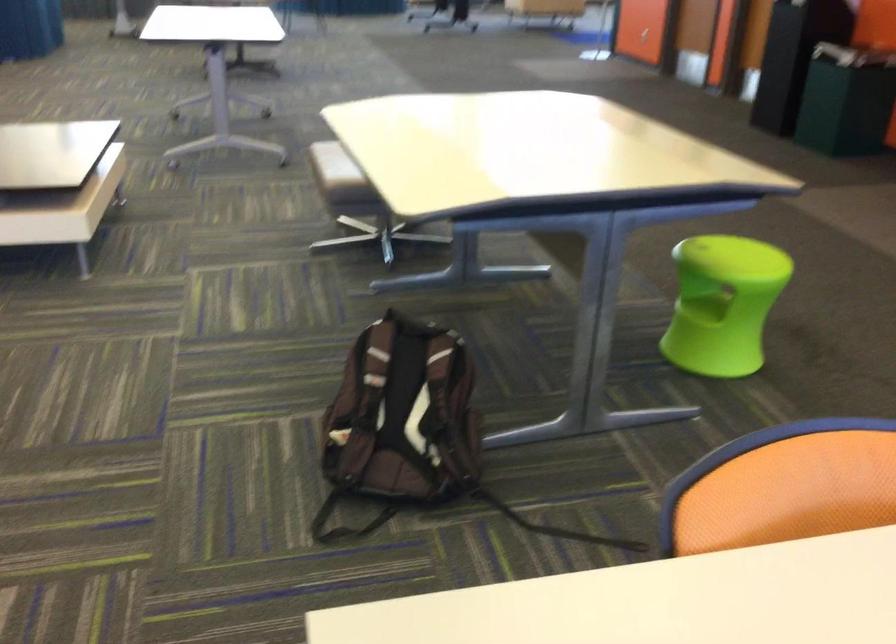
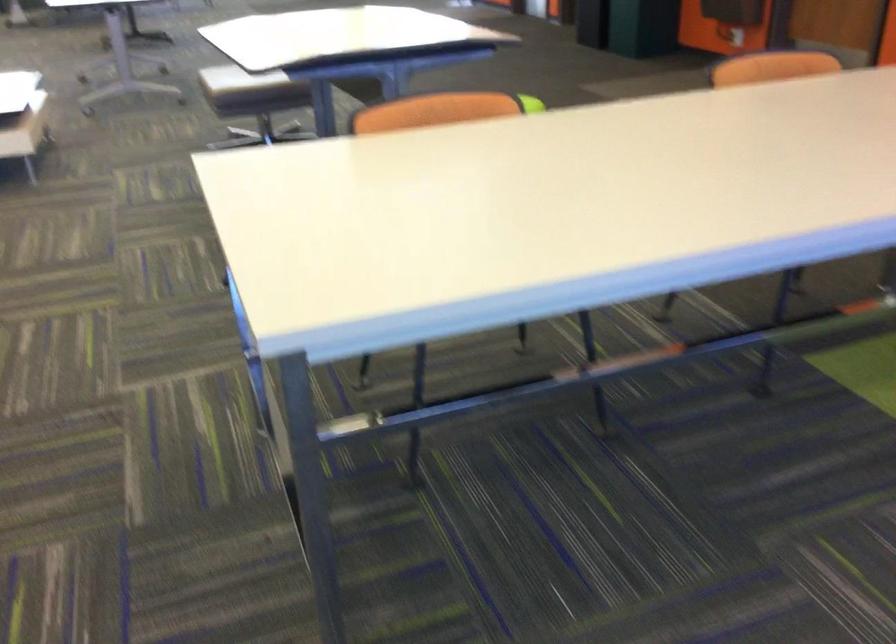
Question: The images are taken continuously from a first-person perspective. In which direction are you moving?

Choices:
 (A) Left
 (B) Right
 (C) Forward
 (D) Backward

Answer: (D)